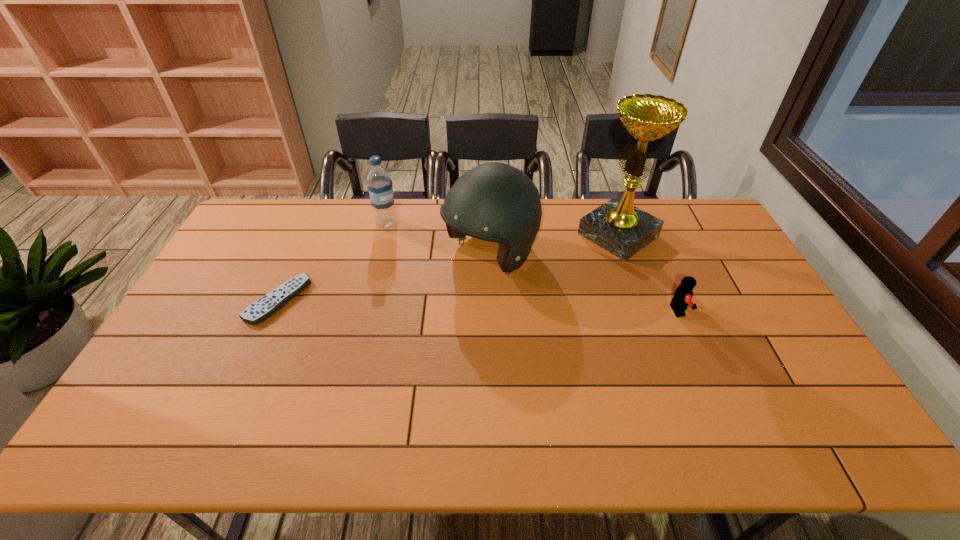
You are a GUI agent. You are given a task and a screenshot of the screen. Output one action in this format:
    pyautogui.click(x=<x>, y=<y>)
    Task: Click on the football helmet located at the far edge
    This screenshot has height=540, width=960.
    Given the screenshot: What is the action you would take?
    pyautogui.click(x=496, y=202)

You are a GUI agent. You are given a task and a screenshot of the screen. Output one action in this format:
    pyautogui.click(x=<x>, y=<y>)
    Task: Click on the water bottle positioned at the far edge
    This screenshot has width=960, height=540.
    Given the screenshot: What is the action you would take?
    (x=379, y=181)

You are a GUI agent. You are given a task and a screenshot of the screen. Output one action in this format:
    pyautogui.click(x=<x>, y=<y>)
    Task: Click on the vacant area at the far edge of the desktop
    
    Given the screenshot: What is the action you would take?
    pyautogui.click(x=351, y=225)

You are a GUI agent. You are given a task and a screenshot of the screen. Output one action in this format:
    pyautogui.click(x=<x>, y=<y>)
    Task: Click on the blank space at the near edge of the desktop
    This screenshot has width=960, height=540.
    Given the screenshot: What is the action you would take?
    pyautogui.click(x=409, y=380)

The image size is (960, 540). Identify the location of free space at the left edge of the desktop. (226, 251).

Image resolution: width=960 pixels, height=540 pixels. Identify the location of blank region between the football helmet and the Lego. (585, 282).

The height and width of the screenshot is (540, 960). What are the coordinates of `empty space between the second tallest object and the third shortest object` in the screenshot? It's located at (439, 239).

Identify the location of free area in between the Lego and the remote control. (478, 305).

The width and height of the screenshot is (960, 540). I want to click on empty space between the second shortest object and the tallest object, so click(648, 272).

Where is `free spot between the third shortest object and the football helmet`? free spot between the third shortest object and the football helmet is located at coordinates (439, 239).